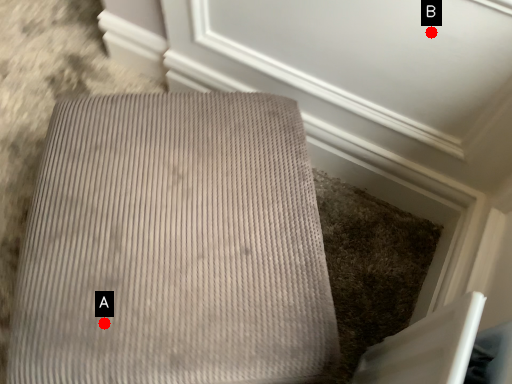
Question: Two points are circled on the image, labeled by A and B beside each circle. Which point appears closest to the camera in this image?

Choices:
 (A) A is closer
 (B) B is closer

Answer: (A)